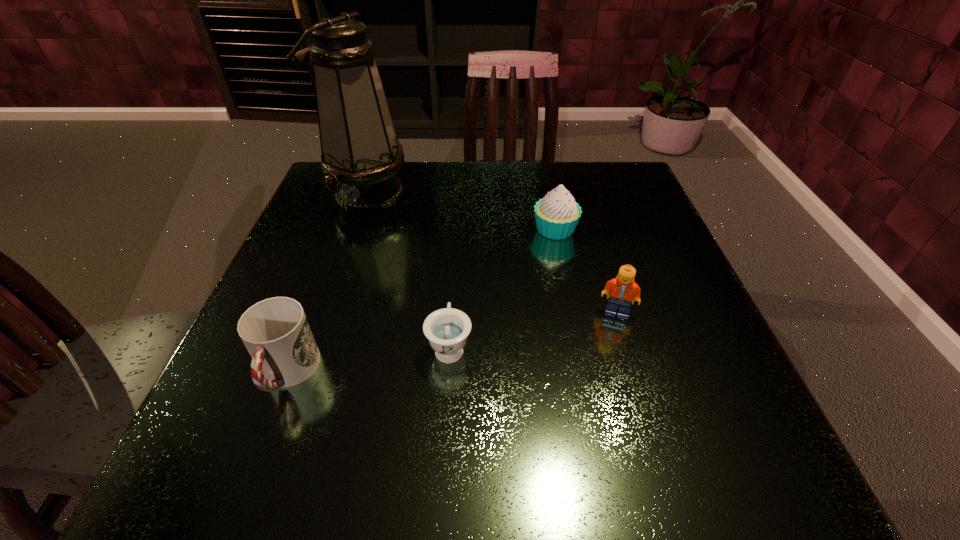
This screenshot has height=540, width=960. I want to click on free location located 0.080m on the side of the cup where the handle is located, so (x=252, y=466).

The height and width of the screenshot is (540, 960). I want to click on vacant region located 0.360m on the side of the third object from right to left with the handle, so click(459, 206).

Identify the location of blank area located on the side of the third object from right to left with the handle. The image size is (960, 540). (455, 266).

Identify the location of vacant space located 0.320m on the side of the third object from right to left with the handle. (458, 216).

Where is `object located in the far edge section of the desktop`? object located in the far edge section of the desktop is located at coordinates (360, 150).

Locate an element on the screen. Image resolution: width=960 pixels, height=540 pixels. oil lamp located at the left edge is located at coordinates (360, 150).

This screenshot has height=540, width=960. I want to click on cup located at the left edge, so click(275, 331).

Locate an element on the screen. The image size is (960, 540). object that is at the right edge is located at coordinates point(622,289).

Where is `object that is positioned at the far left corner`? object that is positioned at the far left corner is located at coordinates (360, 150).

In the image, there is a desktop. Identify the location of vacant space at the far edge. (401, 196).